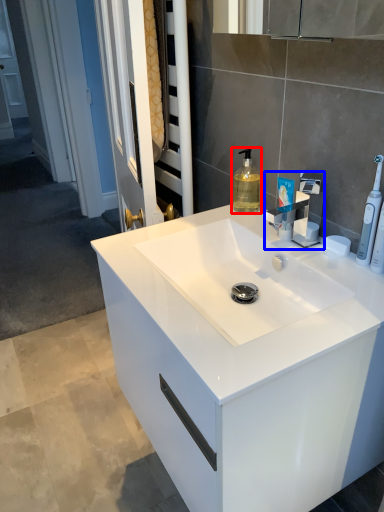
Question: Among these objects, which one is farthest to the camera, soap dispenser (highlighted by a red box) or tap (highlighted by a blue box)?

Choices:
 (A) soap dispenser
 (B) tap

Answer: (A)